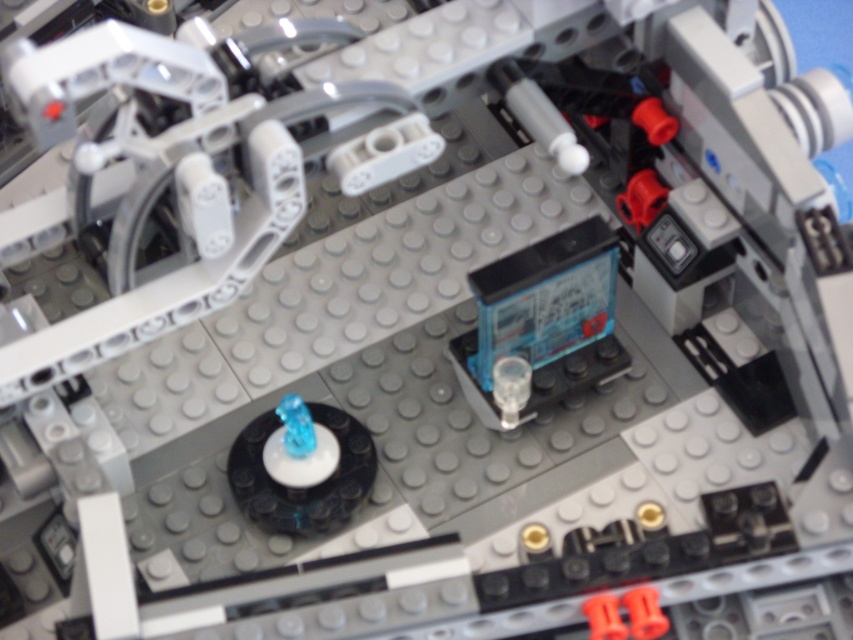
Is point (548, 332) closer to viewer compared to point (341, 445)?

No, (548, 332) is behind (341, 445).

This screenshot has height=640, width=853. What do you see at coordinates (543, 321) in the screenshot?
I see `blue plastic battery at center` at bounding box center [543, 321].

Identify the location of blue plastic battery at center. This screenshot has width=853, height=640. (543, 321).